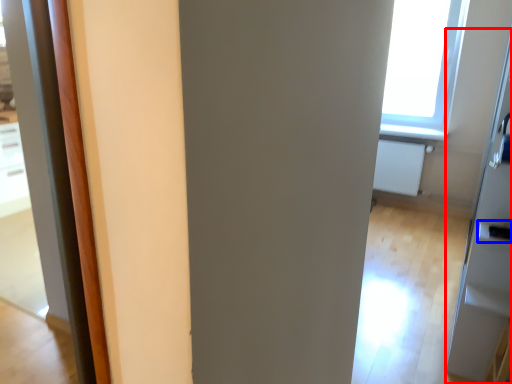
Question: Which point is further to the camera, screen door (highlighted by a red box) or door handle (highlighted by a blue box)?

Choices:
 (A) screen door
 (B) door handle

Answer: (B)